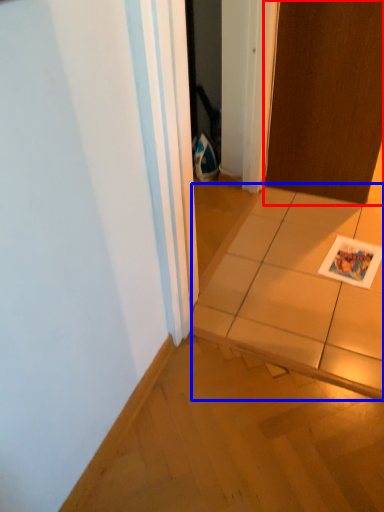
Question: Among these objects, which one is nearest to the camera, door (highlighted by a red box) or tile (highlighted by a blue box)?

Choices:
 (A) door
 (B) tile

Answer: (B)